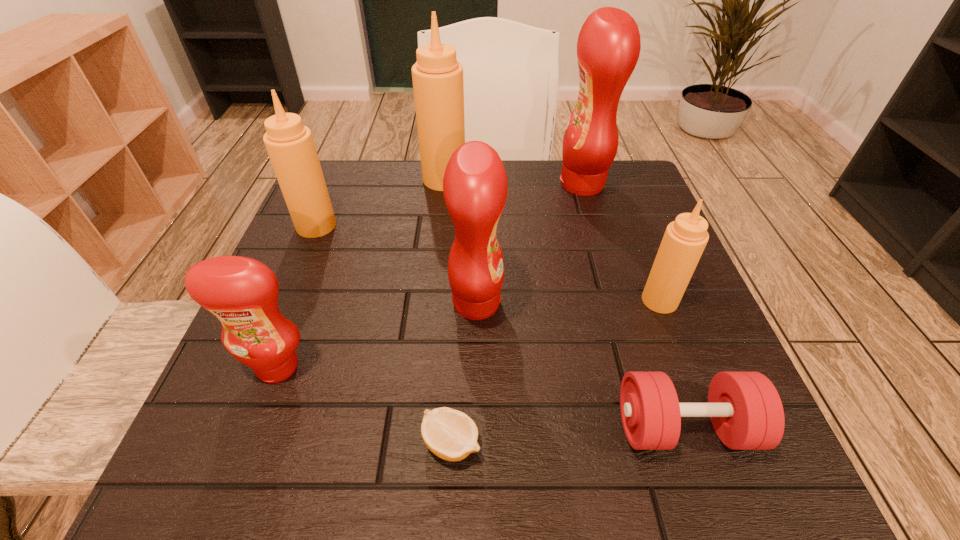
Identify the location of free region that satisfies the following two spatial constraints: 1. on the back side of the nearest tan condiment; 2. on the left side of the lemon. (458, 300).

At what (x,y) coordinates should I click in order to perform the action: click on blank space that satisfies the following two spatial constraints: 1. on the label side of the second red condiment from right to left; 2. on the label side of the third nearest object. Please return your answer as a coordinate pair (x, y). Looking at the image, I should click on (476, 367).